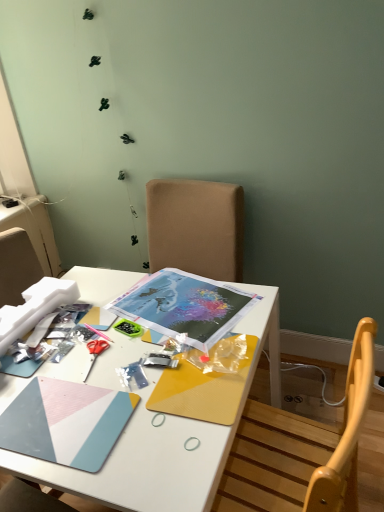
Identify the location of empty space that is ontop of white matte desk at center. (114, 349).